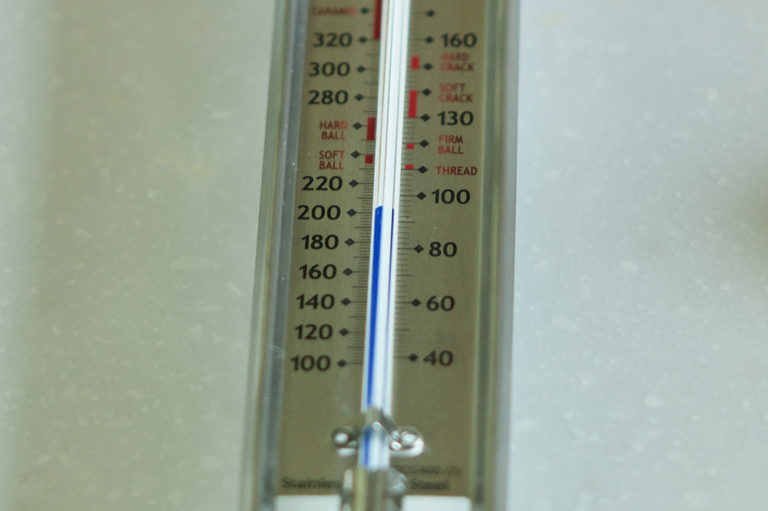
I want to click on table, so click(x=179, y=295).